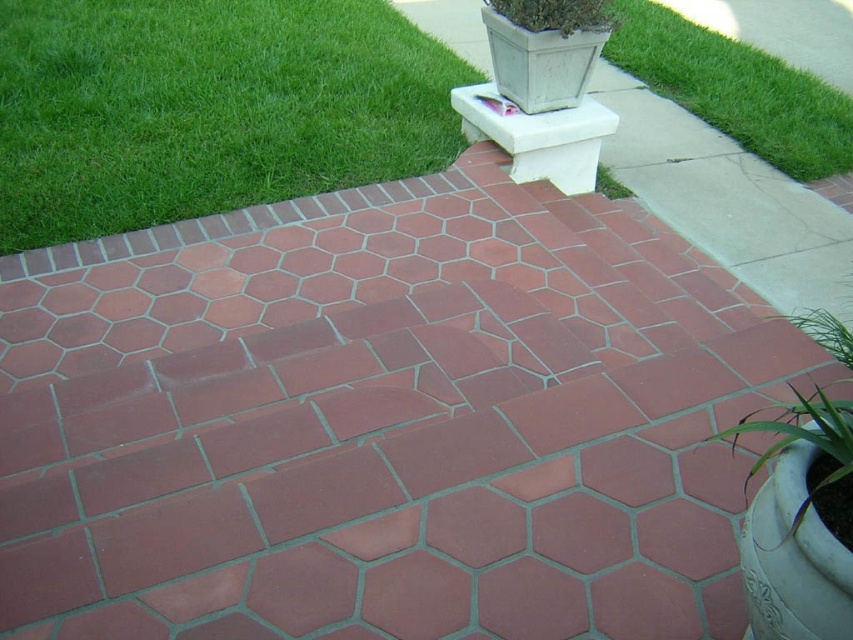
Who is higher up, green grass at upper right or green leafy plant at lower right?

green grass at upper right

Between green grass at upper right and green leafy plant at lower right, which one has more height?

green grass at upper right

Between point (634, 44) and point (792, 416), which one is positioned in front?

Point (792, 416) is more forward.

Locate an element on the screen. green grass at upper right is located at coordinates pyautogui.click(x=738, y=90).

Between point (175, 58) and point (846, 449), which one is positioned in front?

Point (846, 449) is more forward.

Does point (422, 45) come in front of point (848, 452)?

No, (422, 45) is further to viewer.

Between point (32, 3) and point (807, 442), which one is positioned in front?

Point (807, 442) is in front.

Image resolution: width=853 pixels, height=640 pixels. Find the location of `green grass at upper left`. green grass at upper left is located at coordinates (207, 108).

Does point (175, 61) lie behind point (746, 148)?

No, (175, 61) is in front of (746, 148).

Based on the photo, between green grass at upper left and green grass at upper right, which one appears on the left side from the viewer's perspective?

From the viewer's perspective, green grass at upper left appears more on the left side.

Between point (171, 72) and point (846, 122), which one is positioned behind?

The point (846, 122) is behind.

What are the coordinates of `green grass at upper left` in the screenshot? It's located at (207, 108).